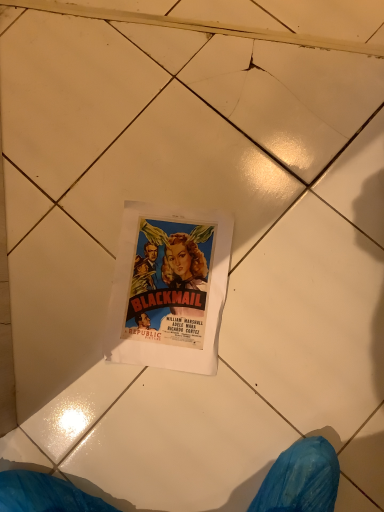
What is the approximate width of matte paper poster at center?

matte paper poster at center is 11.56 inches wide.

Locate an element on the screen. This screenshot has width=384, height=512. matte paper poster at center is located at coordinates (169, 288).

Describe the element at coordinates (169, 288) in the screenshot. I see `matte paper poster at center` at that location.

This screenshot has width=384, height=512. Find the location of `matte paper poster at center`. matte paper poster at center is located at coordinates (169, 288).